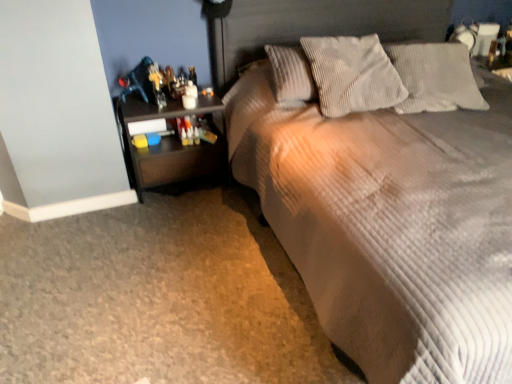
Question: From the image's perspective, is dark wood nightstand at left located beneath gray corduroy pillow at upper center, which is the first pillow from right to left?

Choices:
 (A) no
 (B) yes

Answer: (B)

Question: Is dark wood nightstand at left taller than gray corduroy pillow at upper center, which is the first pillow from right to left?

Choices:
 (A) no
 (B) yes

Answer: (B)

Question: Does dark wood nightstand at left appear on the left side of gray corduroy pillow at upper center, which is the first pillow from right to left?

Choices:
 (A) yes
 (B) no

Answer: (A)

Question: Would you say dark wood nightstand at left contains gray corduroy pillow at upper center, the 2th pillow when ordered from left to right?

Choices:
 (A) no
 (B) yes

Answer: (A)

Question: From a real-world perspective, is dark wood nightstand at left physically above gray corduroy pillow at upper center, the 2th pillow when ordered from left to right?

Choices:
 (A) no
 (B) yes

Answer: (A)

Question: Does dark wood nightstand at left have a larger size compared to gray corduroy pillow at upper center, the 2th pillow when ordered from left to right?

Choices:
 (A) no
 (B) yes

Answer: (B)

Question: Is the position of gray corduroy pillow at upper center, which is the first pillow from right to left, less distant than that of corduroy pillow at upper center, which is the second pillow from right to left?

Choices:
 (A) yes
 (B) no

Answer: (B)

Question: Is gray corduroy pillow at upper center, the 2th pillow when ordered from left to right, smaller than corduroy pillow at upper center, the first pillow from the left?

Choices:
 (A) yes
 (B) no

Answer: (A)

Question: From a real-world perspective, is gray corduroy pillow at upper center, the 2th pillow when ordered from left to right, located higher than corduroy pillow at upper center, which is the second pillow from right to left?

Choices:
 (A) no
 (B) yes

Answer: (A)

Question: Can you confirm if gray corduroy pillow at upper center, the 2th pillow when ordered from left to right, is positioned to the right of corduroy pillow at upper center, which is the second pillow from right to left?

Choices:
 (A) yes
 (B) no

Answer: (A)

Question: Is gray corduroy pillow at upper center, which is the first pillow from right to left, with corduroy pillow at upper center, the first pillow from the left?

Choices:
 (A) yes
 (B) no

Answer: (B)

Question: Is gray corduroy pillow at upper center, the 2th pillow when ordered from left to right, far from corduroy pillow at upper center, which is the second pillow from right to left?

Choices:
 (A) no
 (B) yes

Answer: (A)

Question: Can you confirm if gray corduroy pillow at upper center, the 2th pillow when ordered from left to right, is positioned to the right of dark wood nightstand at left?

Choices:
 (A) yes
 (B) no

Answer: (A)